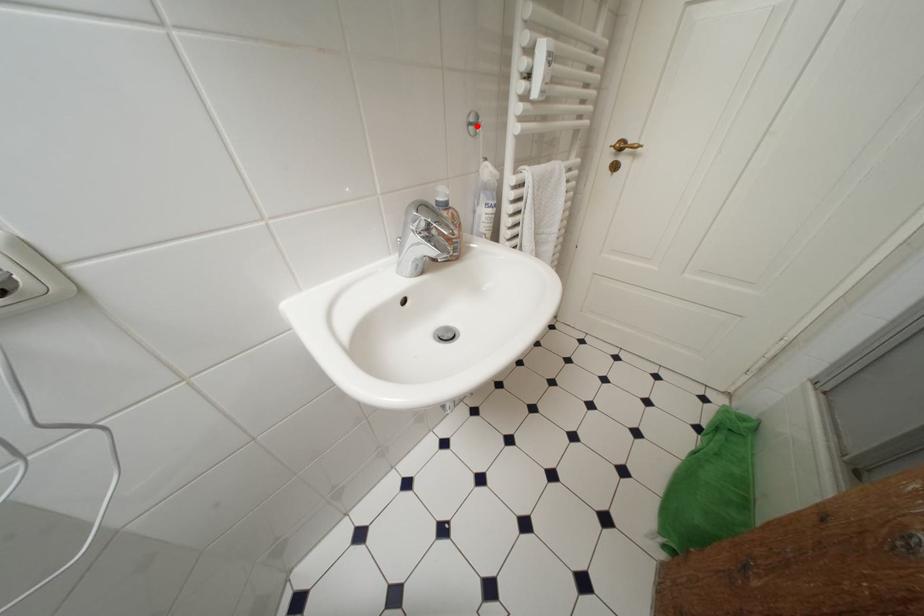
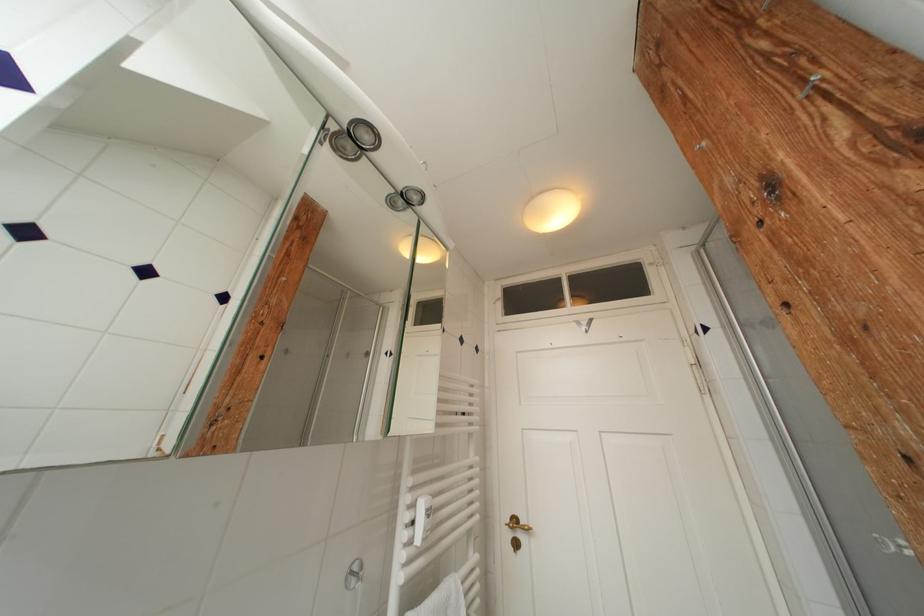
The point at the highlighted location is marked in the first image. Where is the corresponding point in the second image?

(358, 578)